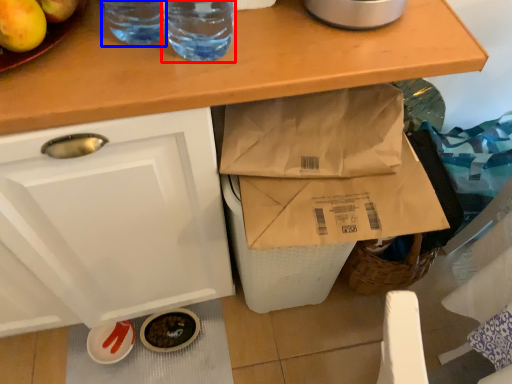
Question: Which object appears farthest to the camera in this image, drinking straw (highlighted by a red box) or drinking straw (highlighted by a blue box)?

Choices:
 (A) drinking straw
 (B) drinking straw

Answer: (B)